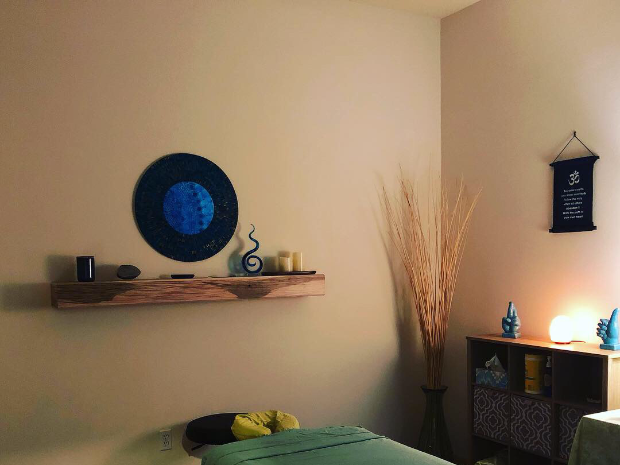
Locate an element on the screen. This screenshot has width=620, height=465. disinfecting wipes is located at coordinates (532, 367).